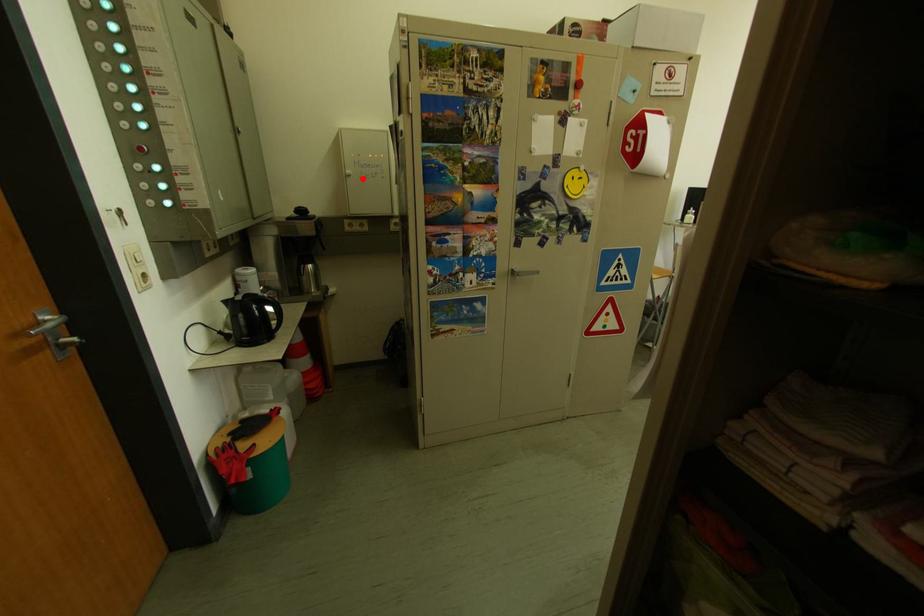
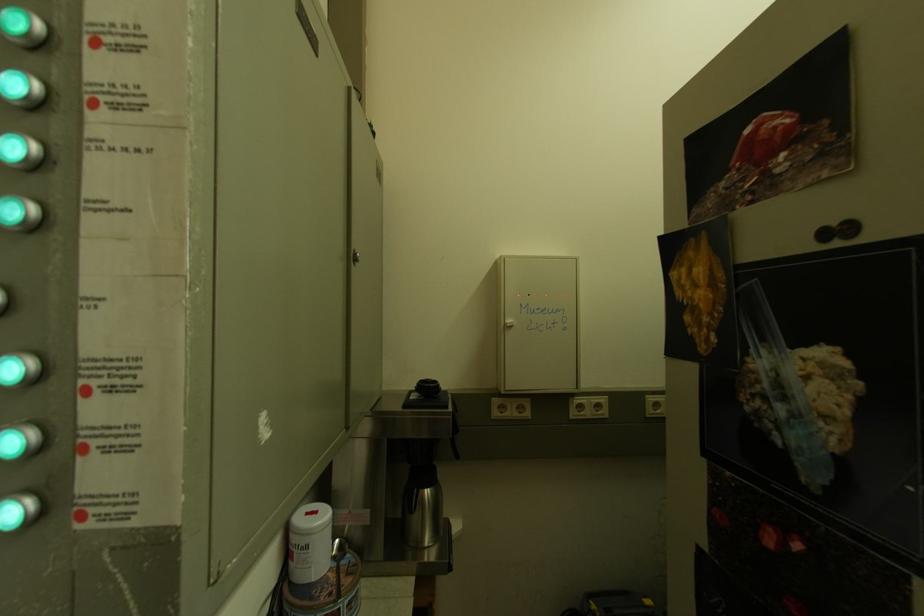
Locate, in the second image, the point that corresponds to the highlighted location in the first image.

(524, 330)